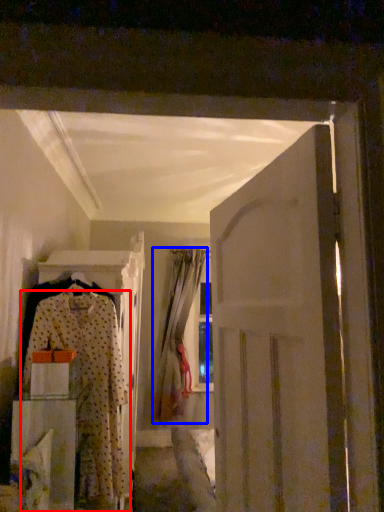
Question: Which point is further to the camera, fancy dress (highlighted by a red box) or curtain (highlighted by a blue box)?

Choices:
 (A) fancy dress
 (B) curtain

Answer: (B)